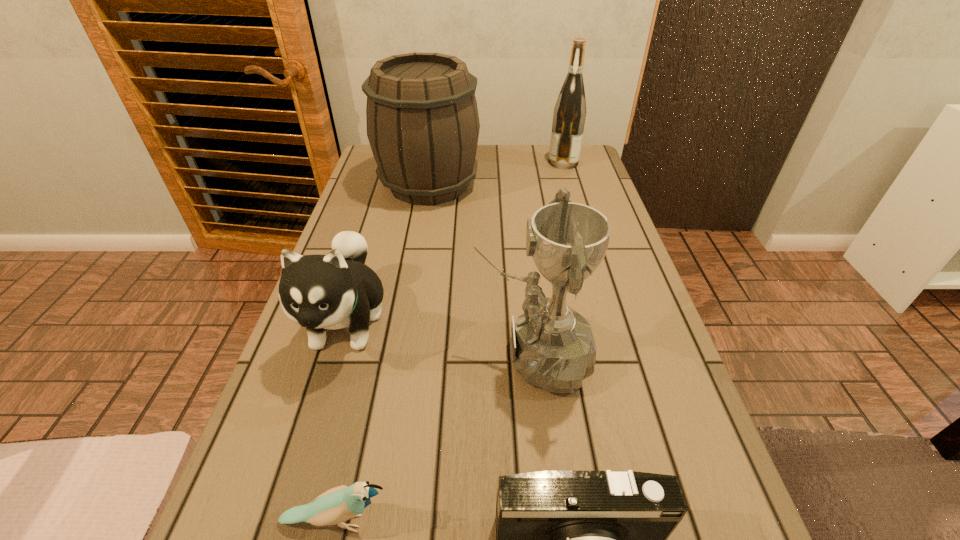
The height and width of the screenshot is (540, 960). I want to click on object that is at the far right corner, so click(569, 115).

This screenshot has width=960, height=540. Find the location of `vacant space at the far edge`. vacant space at the far edge is located at coordinates (511, 148).

The width and height of the screenshot is (960, 540). In the image, there is a desktop. Find the location of `vacant space at the left edge`. vacant space at the left edge is located at coordinates (328, 366).

The image size is (960, 540). Find the location of `vacant space at the right edge of the desktop`. vacant space at the right edge of the desktop is located at coordinates (612, 364).

In the image, there is a desktop. Identify the location of vacant region at the far right corner. The width and height of the screenshot is (960, 540). (580, 165).

Identify the location of unoccupied position between the wine bucket and the bird. (383, 353).

The image size is (960, 540). What are the coordinates of `free spot between the wine bucket and the award` in the screenshot? It's located at (481, 269).

Find the location of a particular element. The width and height of the screenshot is (960, 540). free spot between the puppy and the wine bucket is located at coordinates (388, 252).

Locate an element on the screen. The width and height of the screenshot is (960, 540). free space between the bird and the wine bottle is located at coordinates (450, 342).

Find the location of `free point between the fourth tallest object and the wine bottle`. free point between the fourth tallest object and the wine bottle is located at coordinates (455, 241).